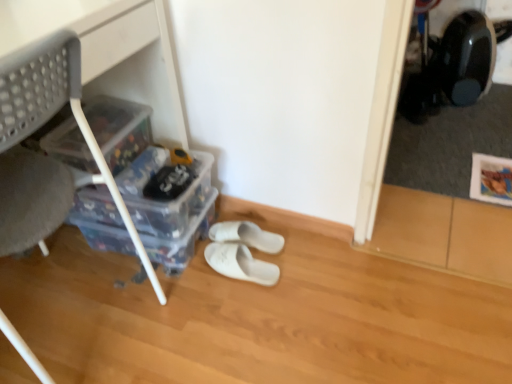
The height and width of the screenshot is (384, 512). I want to click on empty space that is to the right of white fabric slippers at center, which is counted as the second footwear, starting from the front, so click(301, 249).